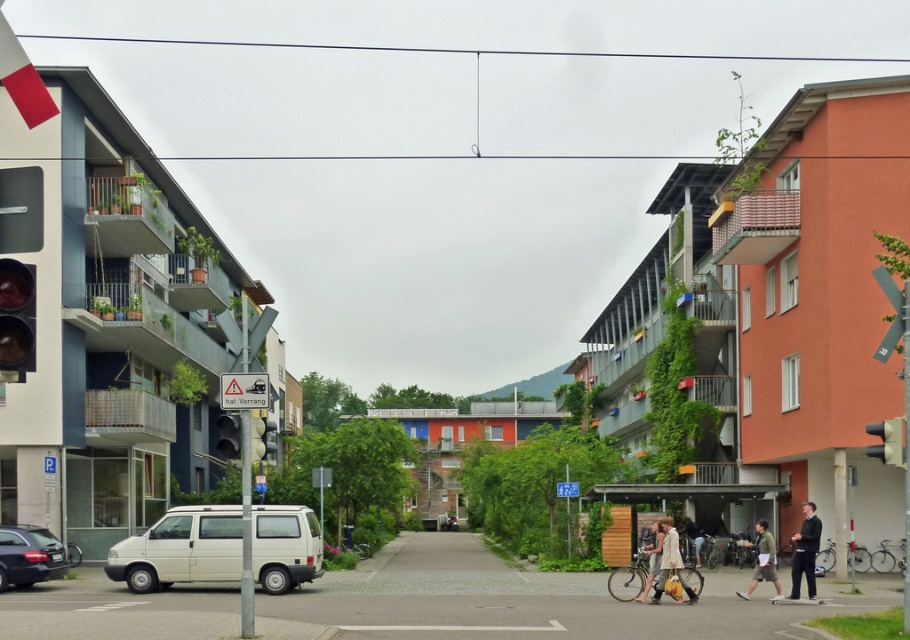
You are a pedestrian standing at the center of the street. You see a shiny black sedan at lower left and a dark suit at lower right. Which object is larger in size?

The dark suit at lower right is larger than the shiny black sedan at lower left.

You are a delivery person who needs to pick up a package from the light brown leather jacket at lower center. The white matte van at center is blocking your path. Can you move the van to access the jacket?

The white matte van at center is above the light brown leather jacket at lower center, so the van is not blocking the jacket. You can access the jacket without moving the van.